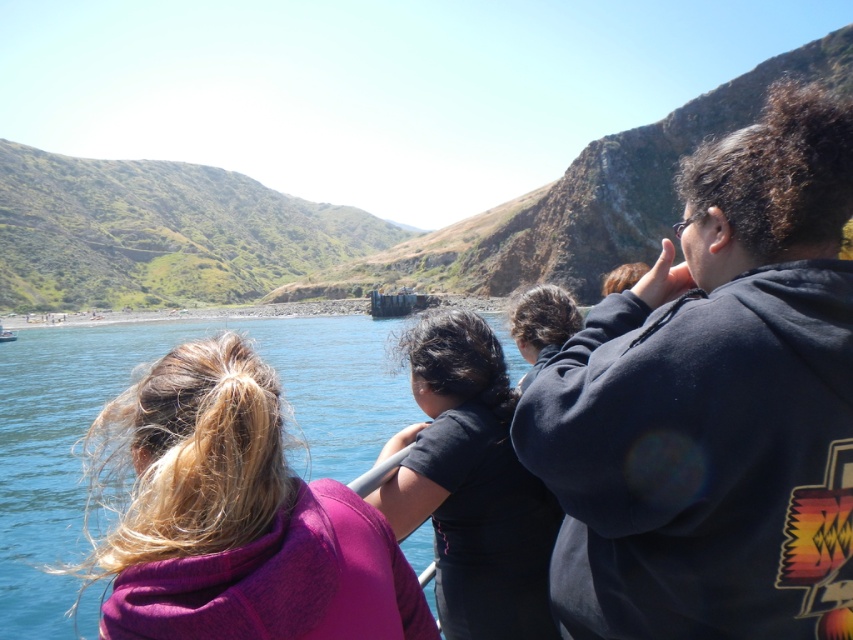
You are a photographer on the boat and want to capture both the dark blue hoodie at upper right and the dark brown hair at center in a single shot. Which direction should you move your camera to include both subjects?

Move your camera to the left to include both the dark blue hoodie at upper right and the dark brown hair at center since the dark blue hoodie at upper right is to the right of dark brown hair at center.